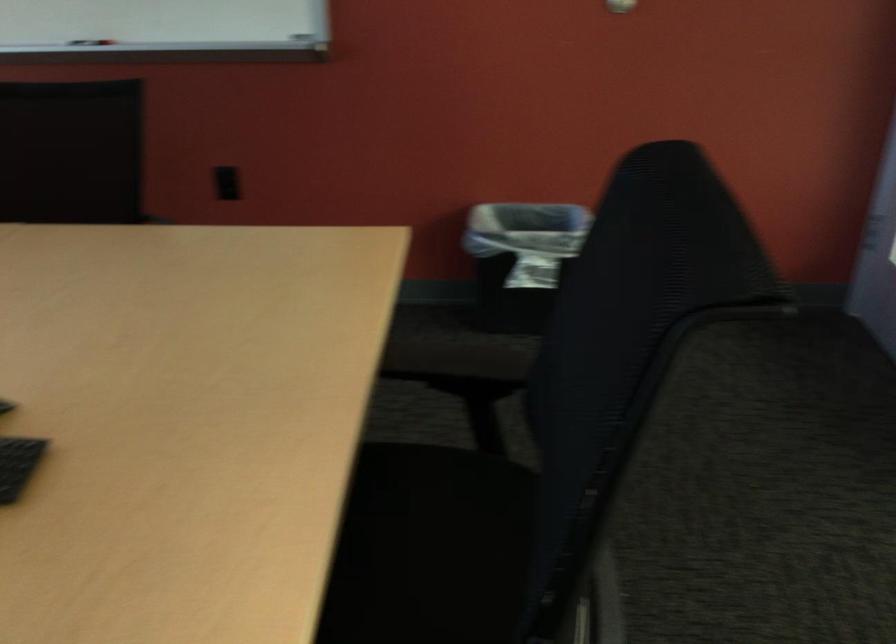
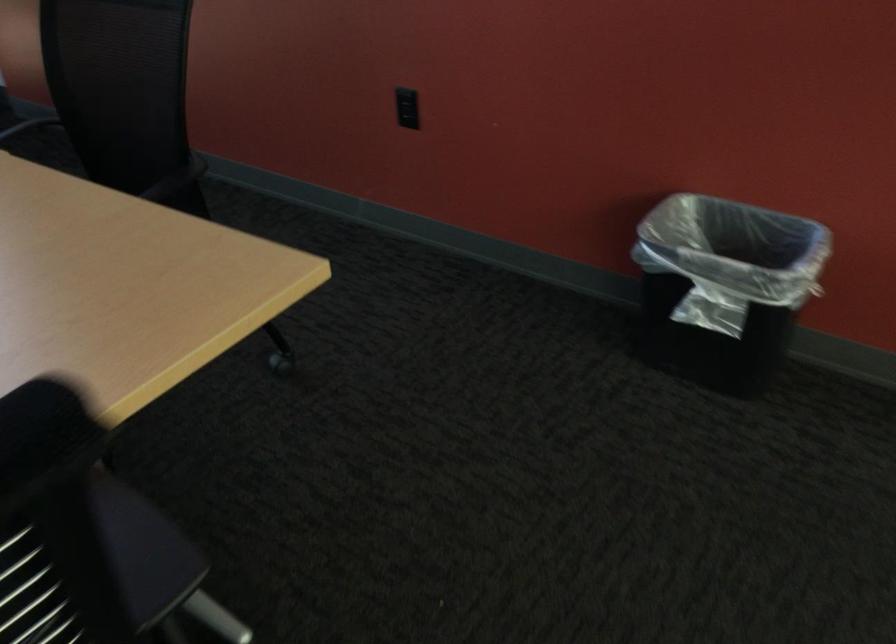
Where in the second image is the point corresponding to point (225, 165) from the first image?

(407, 102)